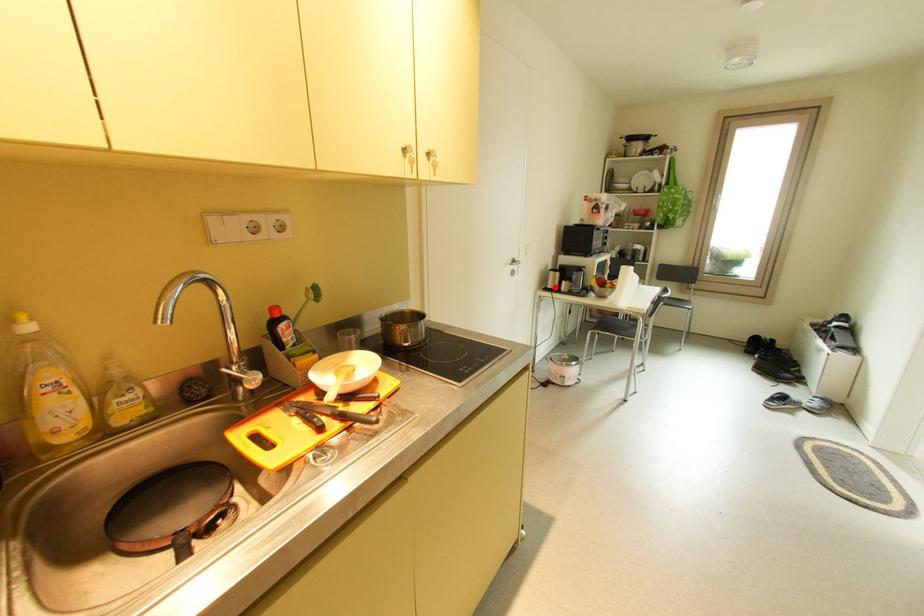
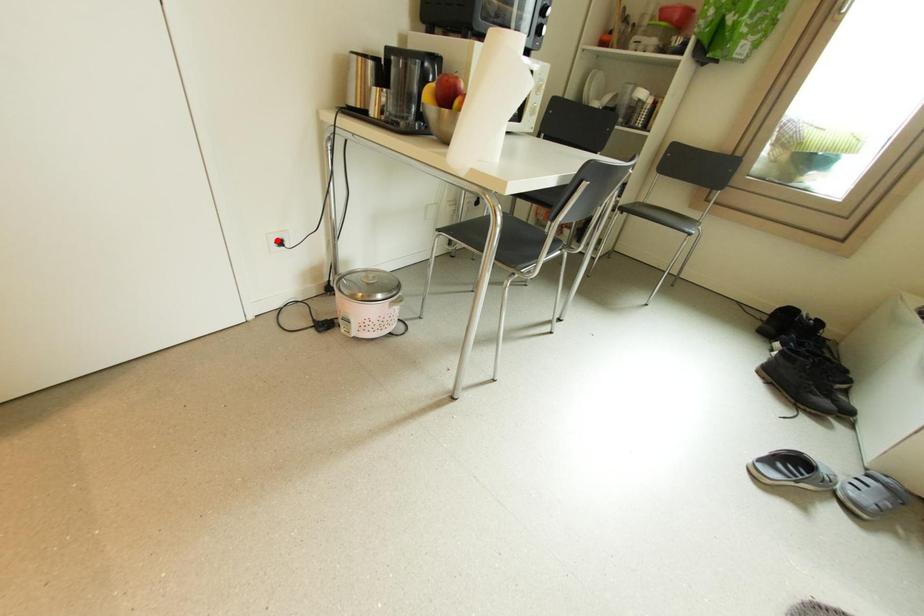
I am providing you with two images of the same scene from different viewpoints. A red point is marked on the first image and another point is marked on the second image. Do the highlighted points in image1 and image2 indicate the same real-world spot?

No